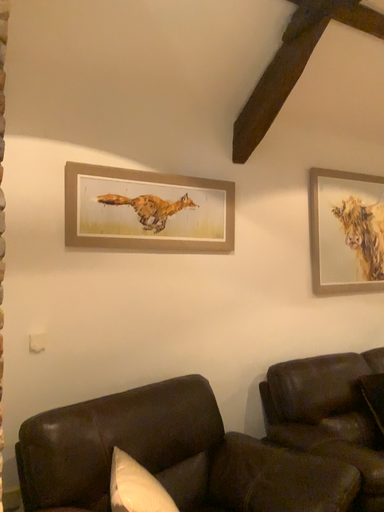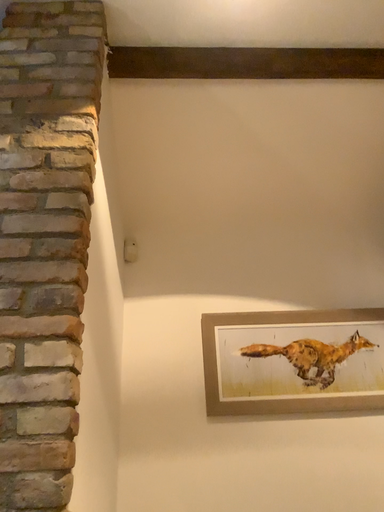
Question: How did the camera likely rotate when shooting the video?

Choices:
 (A) rotated right
 (B) rotated left

Answer: (B)